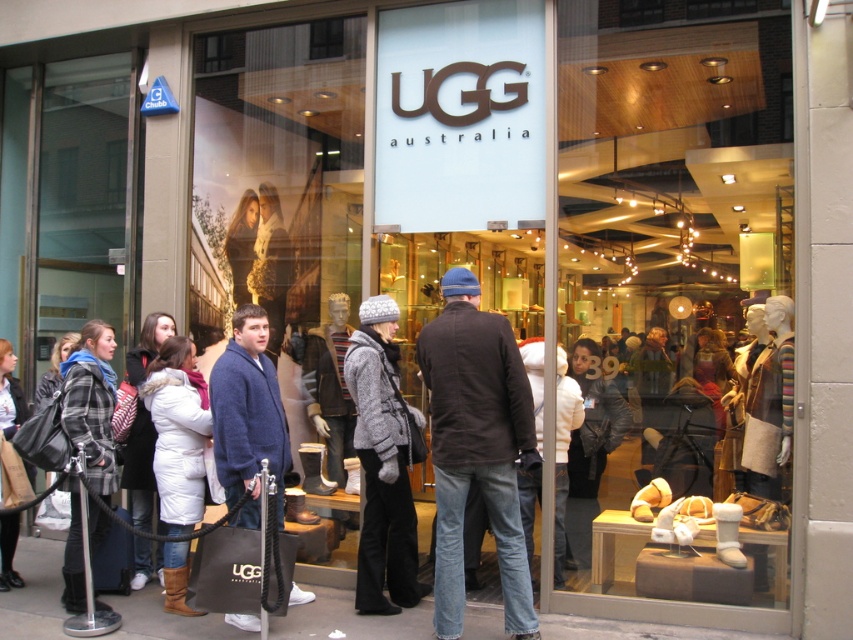
Question: Which point appears closest to the camera in this image?

Choices:
 (A) (787, 337)
 (B) (15, 572)
 (C) (169, 396)
 (D) (519, 356)

Answer: (D)

Question: Which point appears farthest from the camera in this image?

Choices:
 (A) (300, 260)
 (B) (93, 433)

Answer: (A)

Question: Does blue wool sweater at center have a larger size compared to plaid wool coat at left?

Choices:
 (A) no
 (B) yes

Answer: (A)

Question: In this image, where is matte black boots at center located relative to blue wool sweater at center?

Choices:
 (A) below
 (B) above

Answer: (B)

Question: Does white suede boots at center appear on the right side of dark brown leather jacket at center?

Choices:
 (A) no
 (B) yes

Answer: (B)

Question: Which of the following is the farthest from the observer?

Choices:
 (A) (483, 385)
 (B) (3, 358)
 (C) (227, 44)
 (D) (380, 376)

Answer: (C)